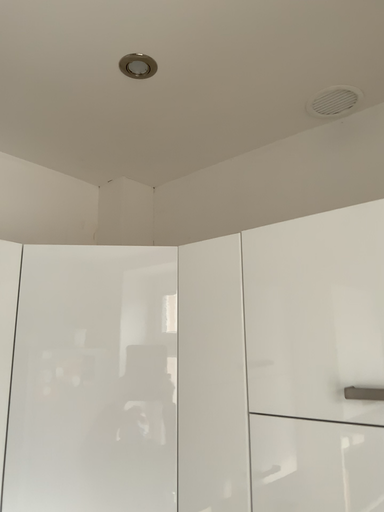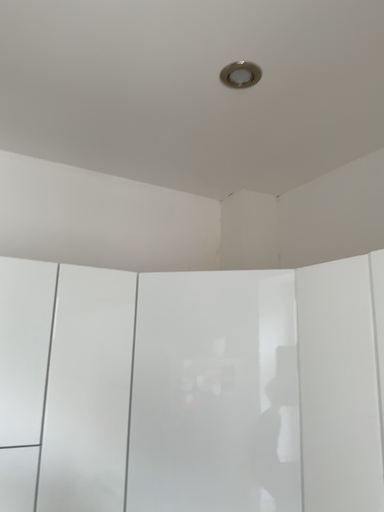
Question: How did the camera likely rotate when shooting the video?

Choices:
 (A) rotated left
 (B) rotated right

Answer: (A)